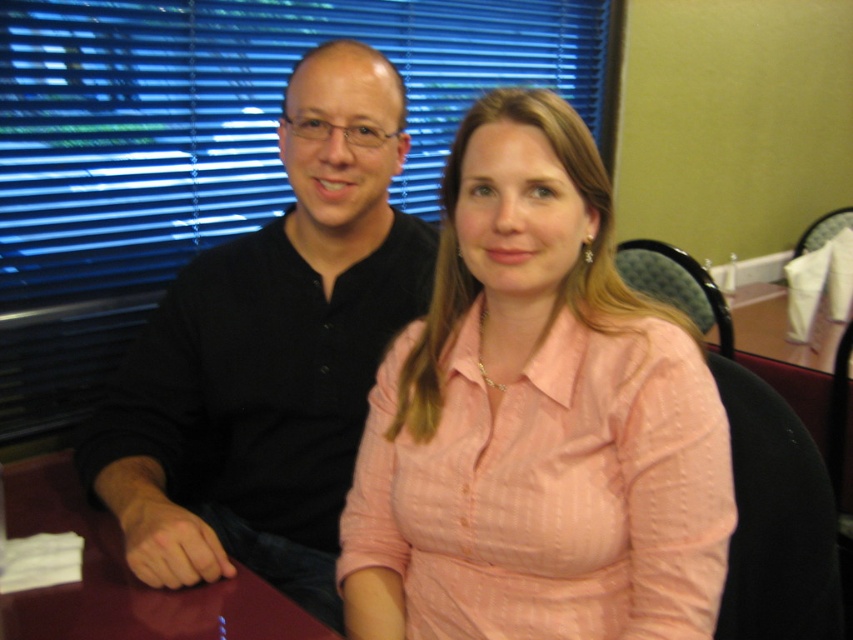
From the picture: Can you confirm if pink textured shirt at center is shorter than black matte shirt at left?

Yes.

Is pink textured shirt at center behind black matte shirt at left?

No, it is in front of black matte shirt at left.

Is point (582, 403) in front of point (223, 262)?

Yes, point (582, 403) is closer to viewer.

Where is `pink textured shirt at center`? The width and height of the screenshot is (853, 640). pink textured shirt at center is located at coordinates (537, 420).

Does pink textured shirt at center have a smaller size compared to blue matte blinds at upper center?

Yes.

How distant is pink textured shirt at center from blue matte blinds at upper center?

37.18 inches

Locate an element on the screen. The image size is (853, 640). pink textured shirt at center is located at coordinates (537, 420).

Identify the location of pink textured shirt at center. The height and width of the screenshot is (640, 853). (537, 420).

Which is below, blue matte blinds at upper center or maroon glossy table at lower left?

Positioned lower is maroon glossy table at lower left.

Does blue matte blinds at upper center appear on the left side of maroon glossy table at lower left?

Incorrect, blue matte blinds at upper center is not on the left side of maroon glossy table at lower left.

I want to click on blue matte blinds at upper center, so click(206, 147).